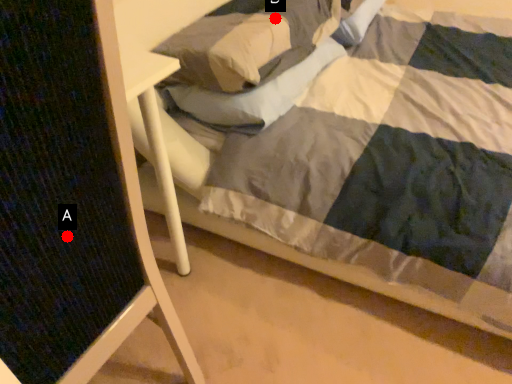
Question: Two points are circled on the image, labeled by A and B beside each circle. Which point is further to the camera?

Choices:
 (A) A is further
 (B) B is further

Answer: (B)